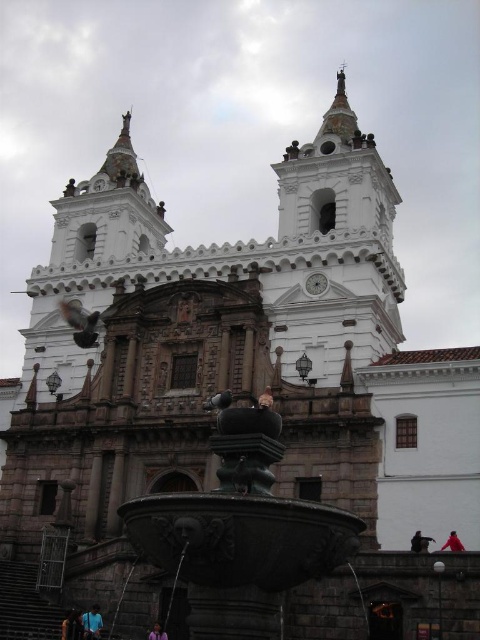
Is blue fabric at lower left thinner than red fabric person at lower right?

In fact, blue fabric at lower left might be wider than red fabric person at lower right.

Is point (92, 614) positioned before point (459, 541)?

No, it is behind (459, 541).

The image size is (480, 640). I want to click on blue fabric at lower left, so click(x=92, y=621).

The height and width of the screenshot is (640, 480). Find the location of `black stone fountain at center`. black stone fountain at center is located at coordinates (240, 532).

Is black stone fountain at center closer to the viewer compared to dark brown hair at lower center?

Yes.

Find the location of a particular element. black stone fountain at center is located at coordinates (240, 532).

Where is `black stone fountain at center`? black stone fountain at center is located at coordinates (240, 532).

Does dark brown leather jacket at lower right have a larger size compared to dark brown hair at lower center?

Indeed, dark brown leather jacket at lower right has a larger size compared to dark brown hair at lower center.

Does dark brown leather jacket at lower right appear under dark brown hair at lower center?

Incorrect, dark brown leather jacket at lower right is not positioned below dark brown hair at lower center.

Where is `dark brown leather jacket at lower right`? The height and width of the screenshot is (640, 480). dark brown leather jacket at lower right is located at coordinates (420, 541).

This screenshot has width=480, height=640. I want to click on dark brown leather jacket at lower right, so click(x=420, y=541).